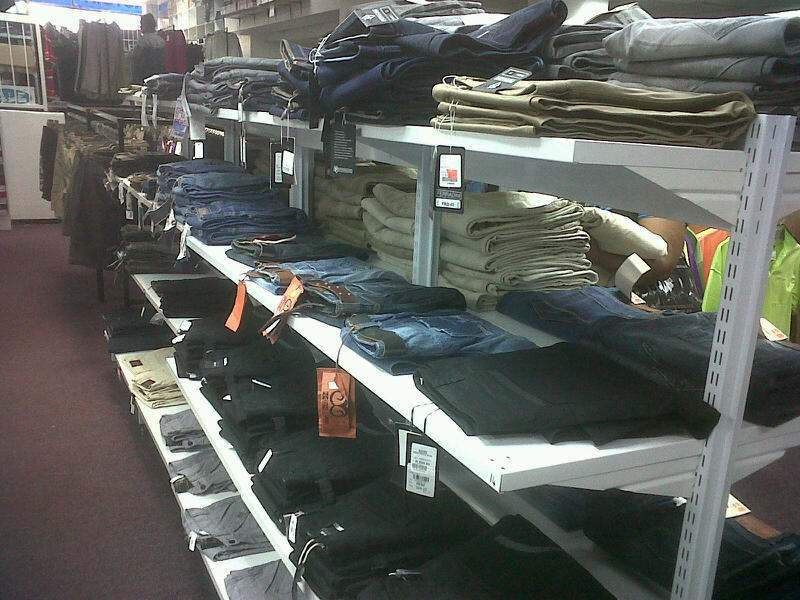
This screenshot has width=800, height=600. I want to click on picture inside of a store, so click(101, 420).